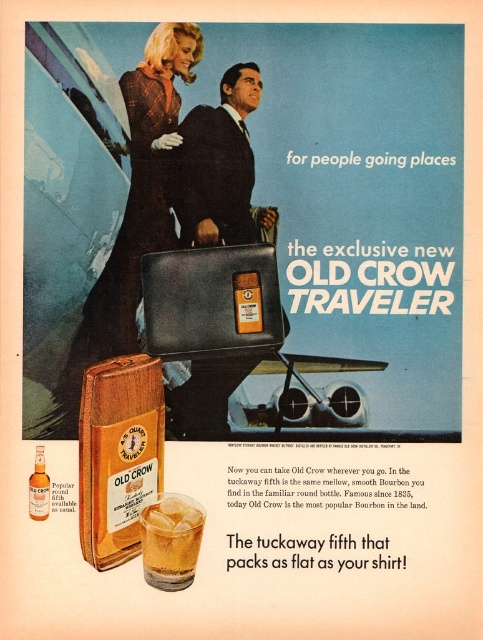
Question: Observing the image, what is the correct spatial positioning of plaid wool coat at center in reference to amber glass bottle at lower left?

Choices:
 (A) below
 (B) above

Answer: (B)

Question: Which point appears closest to the camera in this image?

Choices:
 (A) (40, 506)
 (B) (144, 240)

Answer: (A)

Question: Based on their relative distances, which object is farther from the amber liquid glass at lower center?

Choices:
 (A) smooth leather jacket at center
 (B) plaid wool coat at center
 (C) matte black briefcase at center
 (D) amber glass bottle at lower left

Answer: (A)

Question: Does matte black briefcase at center lie behind amber glass bottle at lower left?

Choices:
 (A) no
 (B) yes

Answer: (B)

Question: Can you confirm if plaid wool coat at center is bigger than amber glass bottle at lower left?

Choices:
 (A) no
 (B) yes

Answer: (B)

Question: Based on their relative distances, which object is farther from the matte black briefcase at center?

Choices:
 (A) plaid wool coat at center
 (B) amber glass bottle at lower left
 (C) smooth leather jacket at center
 (D) amber liquid glass at lower center

Answer: (B)